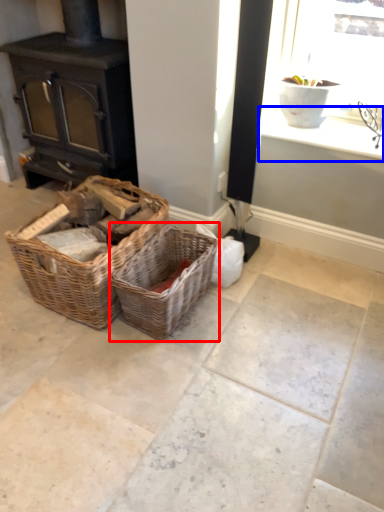
Question: Which object is closer to the camera taking this photo, picnic basket (highlighted by a red box) or window sill (highlighted by a blue box)?

Choices:
 (A) picnic basket
 (B) window sill

Answer: (A)